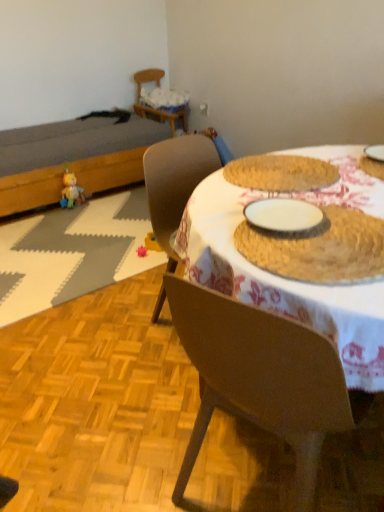
This screenshot has height=512, width=384. I want to click on free space in front of pink fabric toy at lower center, which ranks as the second toy in left-to-right order, so click(137, 266).